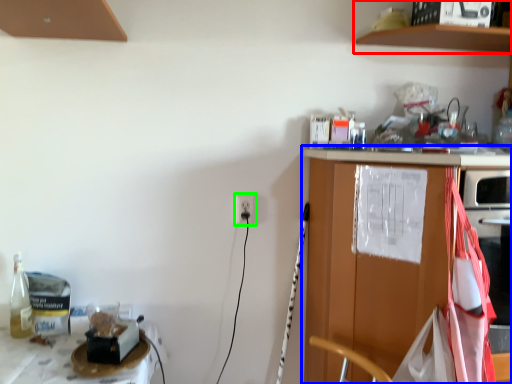
Question: Based on their relative distances, which object is farther from shelf (highlighted by a red box)? Choose from countertop (highlighted by a blue box) and electric outlet (highlighted by a green box).

Choices:
 (A) countertop
 (B) electric outlet

Answer: (B)